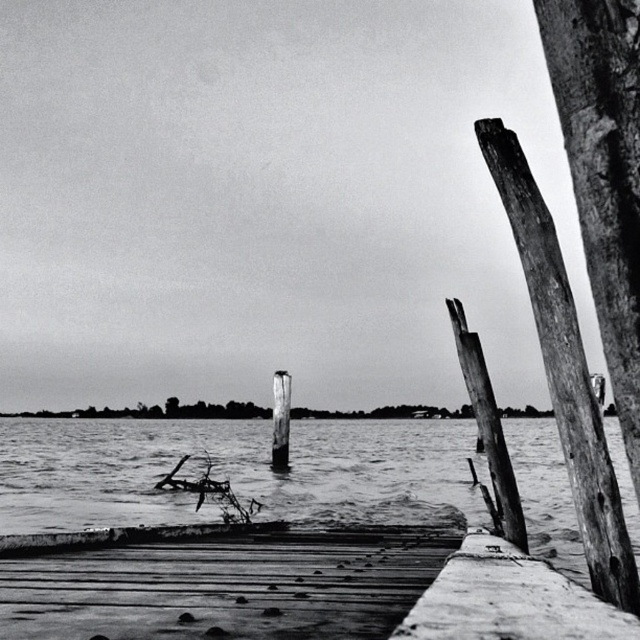
You are standing on the smooth wood dock at lower center and want to place a small potted plant on the smooth wood post at center. Can the potted plant be placed directly on top of the post without any support?

The smooth wood dock at lower center has a lesser height compared to the smooth wood post at center. Since the dock is shorter than the post, you would need to use a ladder or some form of support to reach the top of the smooth wood post at center to place the potted plant.

You are standing on the wooden dock in the scene and want to move towards the wooden post at right. Which direction should you walk to reach it from the weathered wood post at right?

You should walk to the right to reach the wooden post at right from the weathered wood post at right because the weathered wood post at right is to the left of the wooden post at right.

You are a photographer aiming to capture the contrast between aged and well maintained wooden structures. You see the wooden post at right and the smooth wood post at center. Which post is shorter and would better highlight the difference in their conditions?

The wooden post at right has a lesser height compared to the smooth wood post at center, making it shorter and thus better to highlight the contrast between aged and well maintained structures.